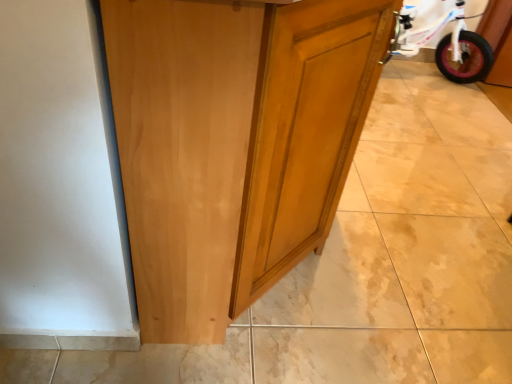
Question: From the image's perspective, relative to glossy wood cupboard at center, is pink rubber tire at right above or below?

Choices:
 (A) below
 (B) above

Answer: (B)

Question: Is pink rubber tire at right inside the boundaries of glossy wood cupboard at center, or outside?

Choices:
 (A) outside
 (B) inside

Answer: (A)

Question: Does point (483, 41) appear closer or farther from the camera than point (198, 286)?

Choices:
 (A) farther
 (B) closer

Answer: (A)

Question: Is glossy wood cupboard at center spatially inside pink rubber tire at right, or outside of it?

Choices:
 (A) outside
 (B) inside

Answer: (A)

Question: Is glossy wood cupboard at center taller or shorter than pink rubber tire at right?

Choices:
 (A) tall
 (B) short

Answer: (A)

Question: Relative to pink rubber tire at right, is glossy wood cupboard at center in front or behind?

Choices:
 (A) behind
 (B) front

Answer: (B)

Question: From the image's perspective, relative to pink rubber tire at right, is glossy wood cupboard at center above or below?

Choices:
 (A) below
 (B) above

Answer: (A)